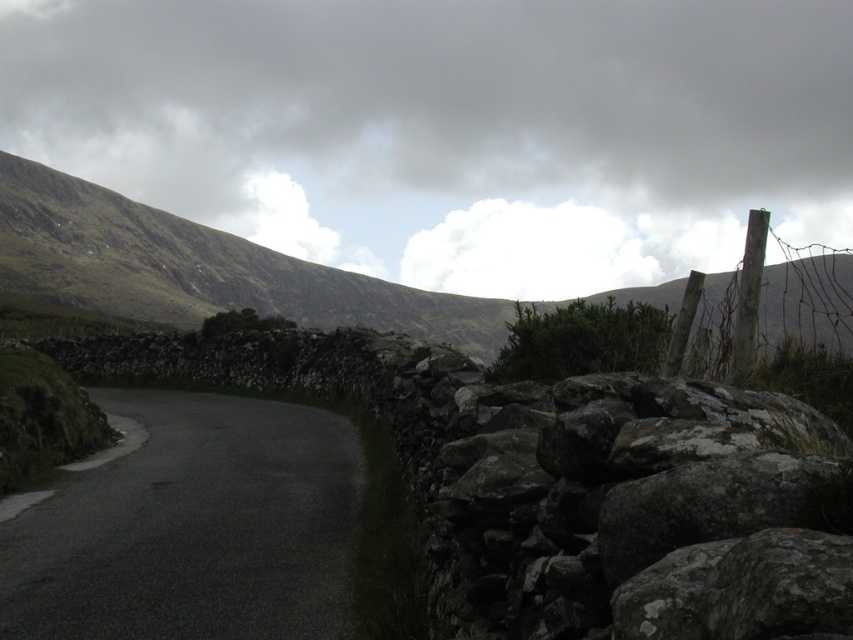
You are driving along the narrow road bordered by stone walls and notice the white fluffy cloud at upper center and the gray rough stone at right. Which object is higher in the sky?

The white fluffy cloud at upper center is positioned over the gray rough stone at right, so it is higher in the sky.

You are standing at the starting point of the road and want to reach a destination located at point [61,620]. There is an obstacle at point [676,570]. Will you encounter this obstacle before reaching your destination?

Point [676,570] is in front of point [61,620], so yes, you will encounter the obstacle at point [676,570] before reaching your destination.